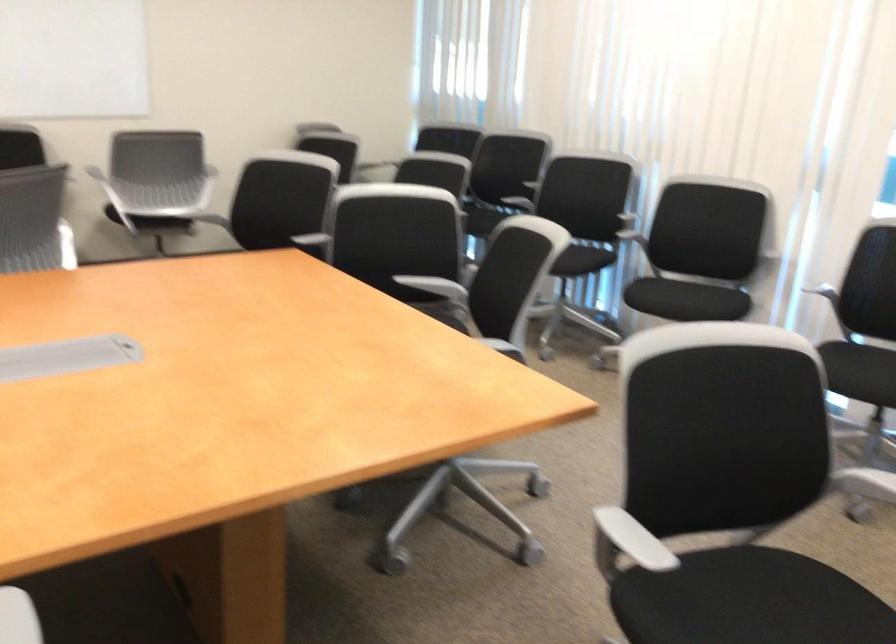
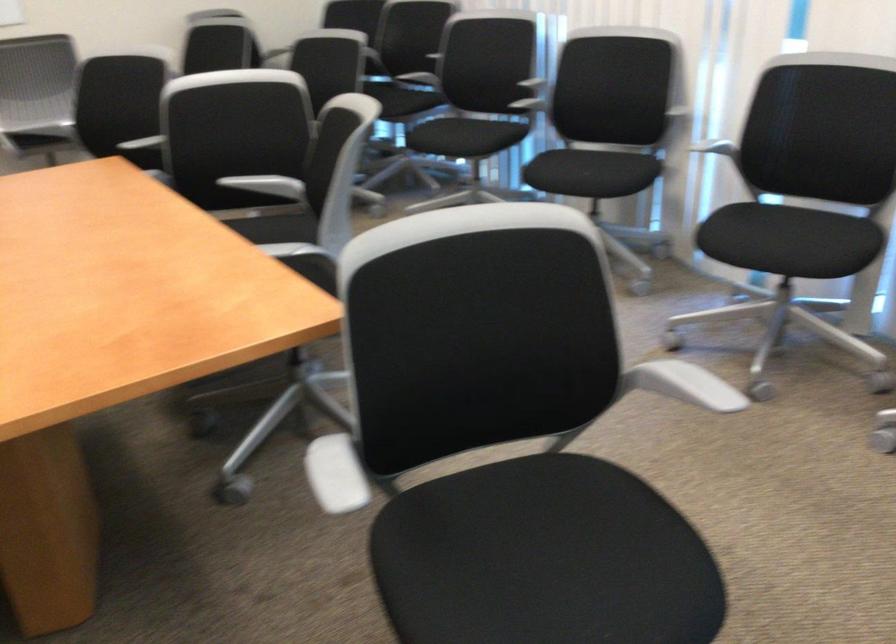
Where in the second image is the point corresponding to (692,295) from the first image?

(587, 174)